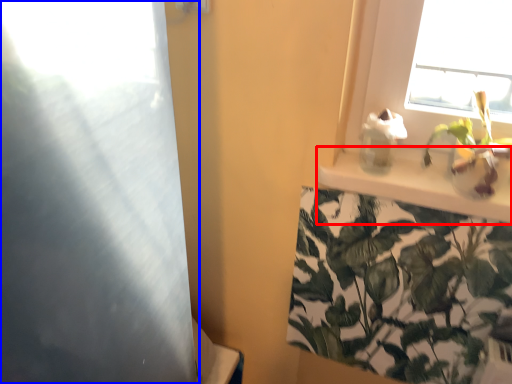
Question: Which object appears farthest to the camera in this image, window sill (highlighted by a red box) or screen door (highlighted by a blue box)?

Choices:
 (A) window sill
 (B) screen door

Answer: (A)